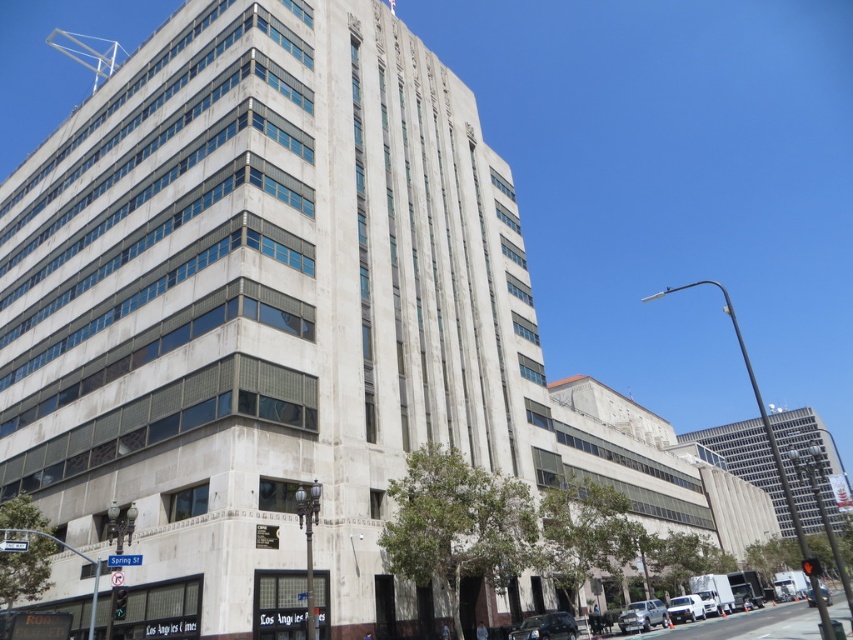
Question: Is silver metallic sedan at lower right thinner than white matte car at lower right?

Choices:
 (A) yes
 (B) no

Answer: (A)

Question: Can you confirm if shiny black sedan at lower right is positioned above shiny black sedan at center?

Choices:
 (A) no
 (B) yes

Answer: (B)

Question: Which object is the farthest from the silver metallic sedan at lower right?

Choices:
 (A) shiny black sedan at center
 (B) shiny black sedan at lower right
 (C) white matte car at lower right

Answer: (A)

Question: Which object is closer to the camera taking this photo?

Choices:
 (A) shiny black sedan at lower right
 (B) white matte car at lower right

Answer: (A)

Question: Which of the following is the closest to the observer?

Choices:
 (A) (573, 627)
 (B) (821, 589)
 (C) (688, 614)
 (D) (647, 611)

Answer: (A)

Question: From the image, what is the correct spatial relationship of silver metallic sedan at lower right in relation to white matte car at lower right?

Choices:
 (A) left
 (B) right

Answer: (A)